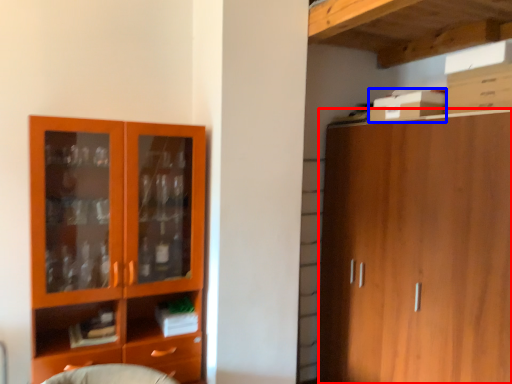
Question: Among these objects, which one is nearest to the camera, cabinetry (highlighted by a red box) or cardboard box (highlighted by a blue box)?

Choices:
 (A) cabinetry
 (B) cardboard box

Answer: (A)